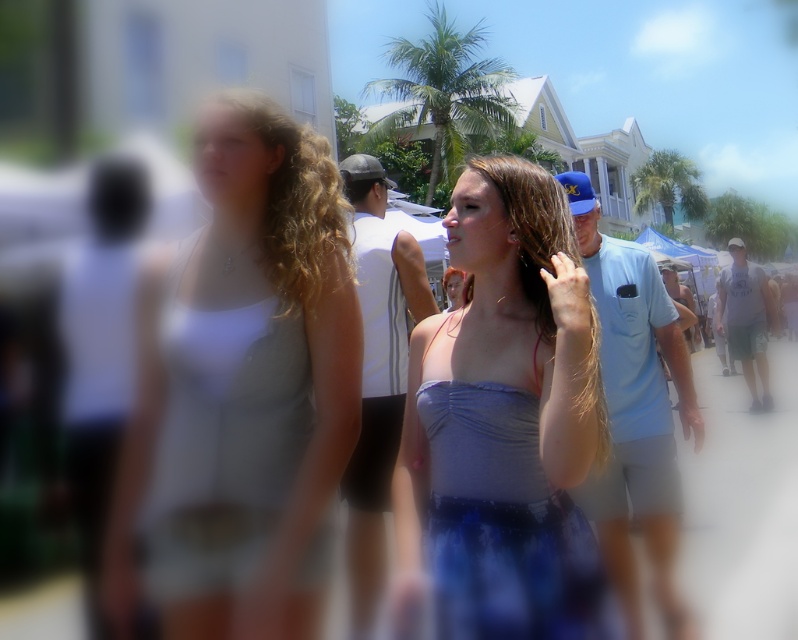
You are a photographer who wants to capture a clear shot of the brown curly hair at center and the satin blue dress at center. Based on the scene description, which object should you focus on to ensure it appears sharp in the photo?

The brown curly hair at center should be focused on because it is above the satin blue dress at center, so focusing on it will ensure both are in focus as the dress is below it.

You are a photographer trying to capture the two women in the scene. The matte blue dress at center and the satin blue dress at center are both in your viewfinder. Which dress should you focus on if you want to capture the one that is higher in the frame?

The matte blue dress at center is located above the satin blue dress at center, so focusing on the matte blue dress at center will capture the higher positioned dress in the frame.